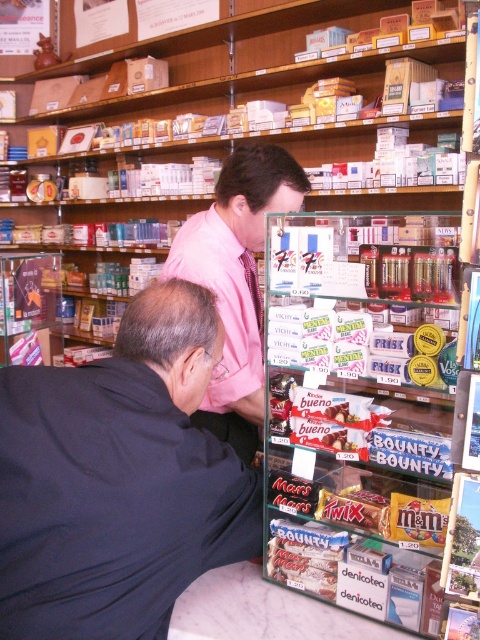
Question: Can you confirm if black matte jacket at lower left is bigger than pink woven tie at center?

Choices:
 (A) no
 (B) yes

Answer: (B)

Question: Which of these objects is positioned farthest from the pink shirt at center?

Choices:
 (A) pink woven tie at center
 (B) black matte jacket at lower left
 (C) pink satin dress shirt at upper center

Answer: (B)

Question: Among these objects, which one is farthest from the camera?

Choices:
 (A) pink satin dress shirt at upper center
 (B) pink shirt at center
 (C) pink woven tie at center

Answer: (C)

Question: Where is black matte jacket at lower left located in relation to pink satin dress shirt at upper center in the image?

Choices:
 (A) below
 (B) above

Answer: (A)

Question: Which of these objects is positioned closest to the pink shirt at center?

Choices:
 (A) black matte jacket at lower left
 (B) pink woven tie at center
 (C) pink satin dress shirt at upper center

Answer: (C)

Question: Can you confirm if pink satin dress shirt at upper center is positioned to the right of pink woven tie at center?

Choices:
 (A) yes
 (B) no

Answer: (B)